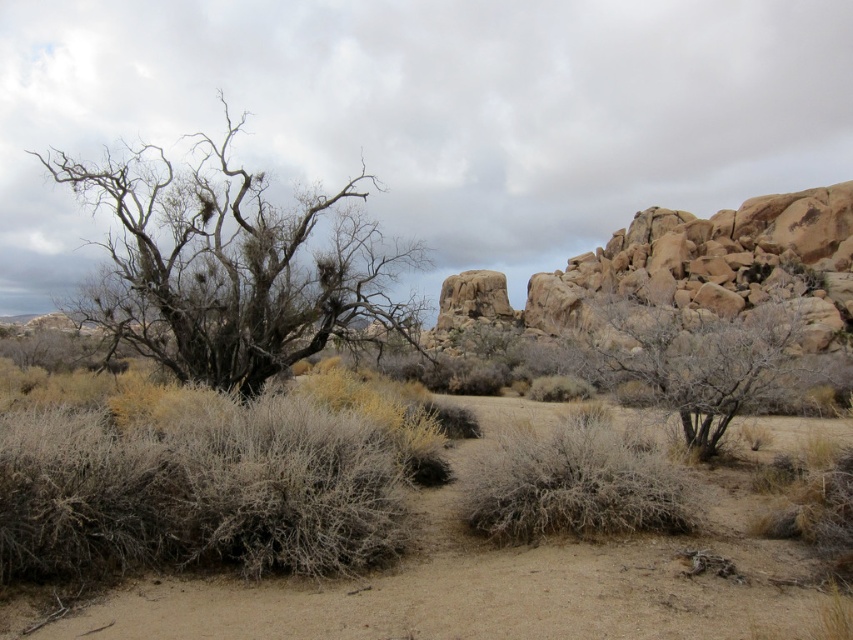
You are standing in the desert scene described. You notice both the brown sandy soil at center and the dry shrub at center. Which object is nearer to you?

The brown sandy soil at center is closer to the viewer than the dry shrub at center.

You are a desert explorer and need to determine which of the two plants at the center of the desert scene is narrower. The plants in question are the fuzzy gray bush at center and the dry shrub at center. Which one has a smaller width?

The fuzzy gray bush at center has a lesser width compared to dry shrub at center, so the fuzzy gray bush at center is narrower.